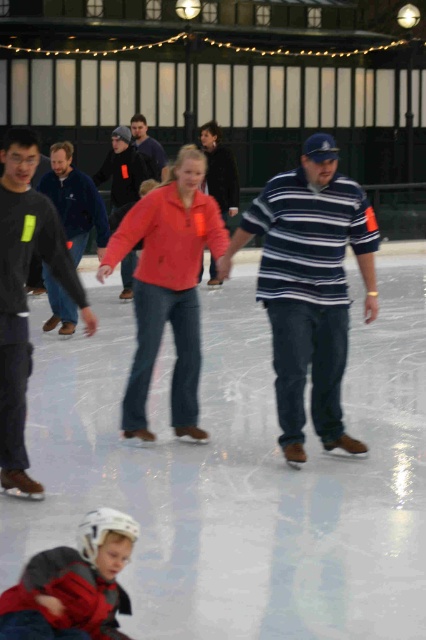
Based on the scene description, which object is positioned higher in the image, the matte brown ice skates at center or the matte black jacket at center?

The matte brown ice skates at center is much taller than the matte black jacket at center, so it is positioned higher in the image.

You are a photographer standing at the edge of the ice rink. You want to take a photo of both the matte pink jacket at center and the orange fleece jacket at center. Which one should you focus on first to ensure they are both in the frame?

The matte pink jacket at center is much taller than the orange fleece jacket at center, so you should focus on the taller matte pink jacket at center first to ensure both are in the frame.

In the scene shown: You are a safety officer at the ice rink and need to ensure there is enough space between skaters for safety. According to the rink rules, skaters must maintain a distance of at least 1.5 meters between each other. Are the matte pink jacket at center and orange fleece jacket at center complying with the safety distance rule?

The matte pink jacket at center and orange fleece jacket at center are 1.38 meters apart, which is less than the required 1.5 meters. Therefore, they are not complying with the safety distance rule.